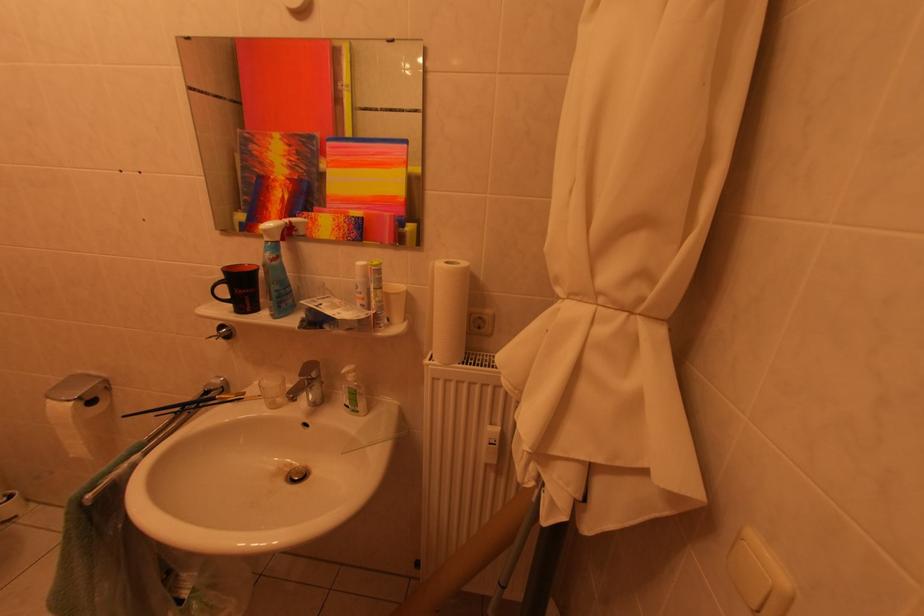
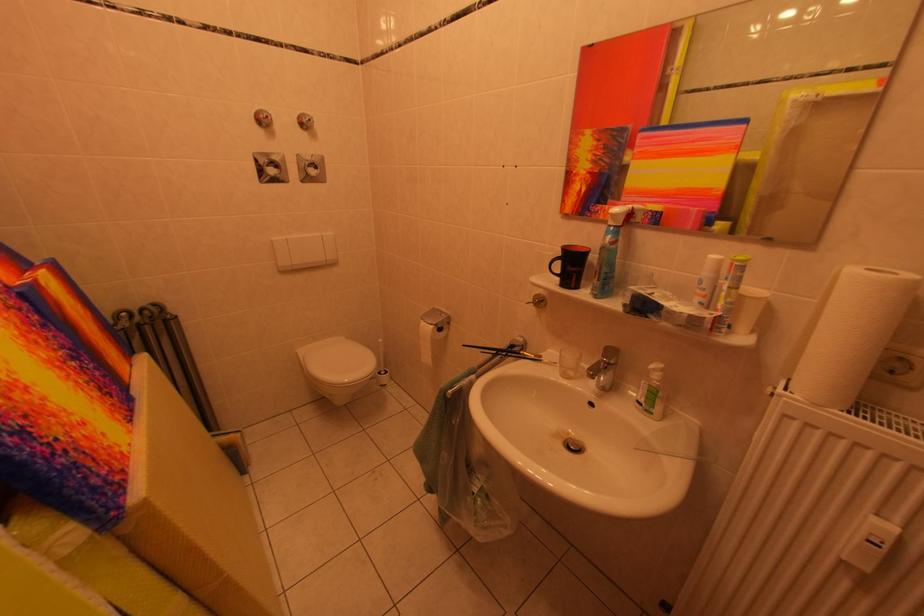
In the second image, find the point that corresponds to (x=442, y=363) in the first image.

(800, 397)